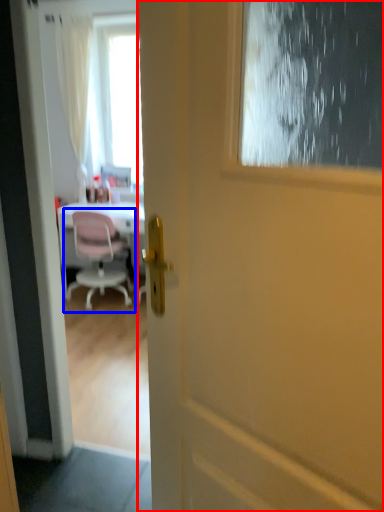
Question: Which of the following is the farthest to the observer, door (highlighted by a red box) or chair (highlighted by a blue box)?

Choices:
 (A) door
 (B) chair

Answer: (B)